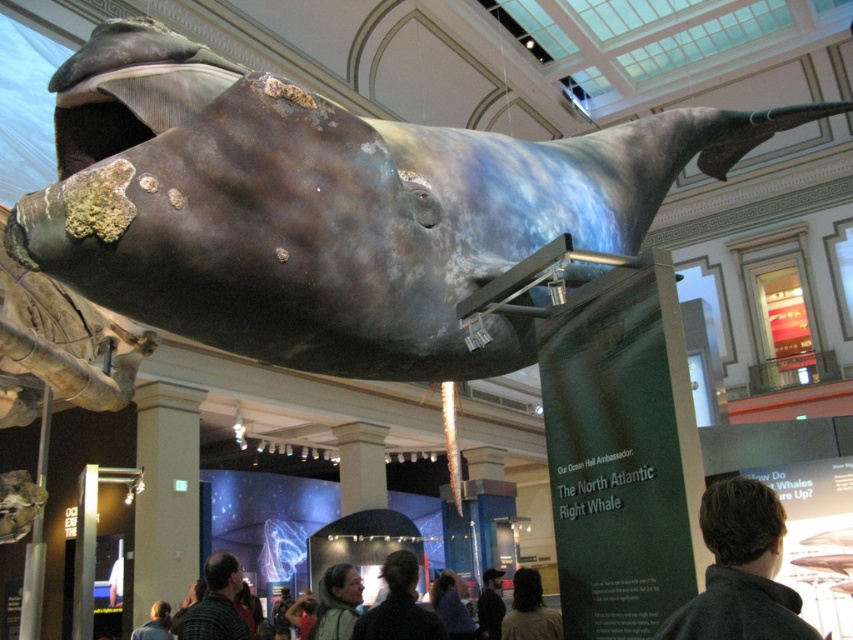
You are a museum visitor who wants to take a photo of the North Atlantic Right Whale model. You have two sweaters with you, the dark brown sweater at lower left and the gray wool sweater at lower center. If you want to use the one that is wider to cover yourself while taking the photo, which sweater should you choose?

The dark brown sweater at lower left might be wider than the gray wool sweater at lower center, so you should choose the dark brown sweater at lower left to cover yourself while taking the photo.